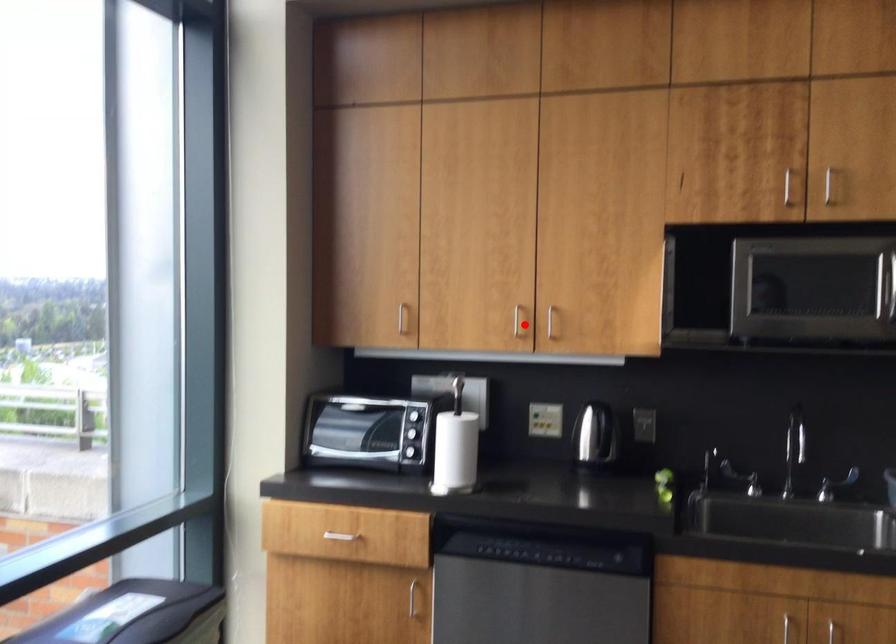
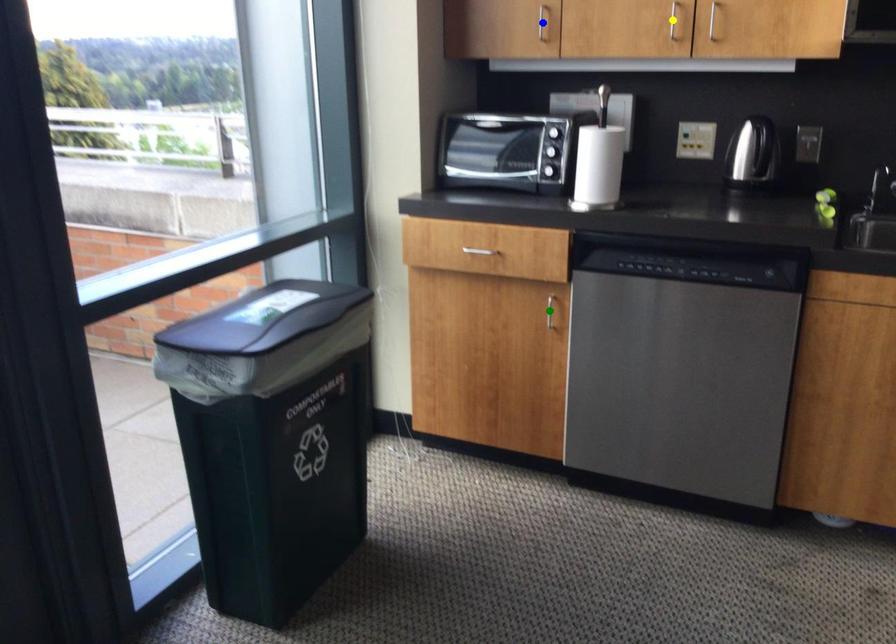
Question: I am providing you with two images of the same scene from different viewpoints. A red point is marked on the first image. You are given multiple points on the second image. In image 2, which mark is for the same physical point as the one in image 1?

Choices:
 (A) yellow point
 (B) blue point
 (C) green point

Answer: (A)